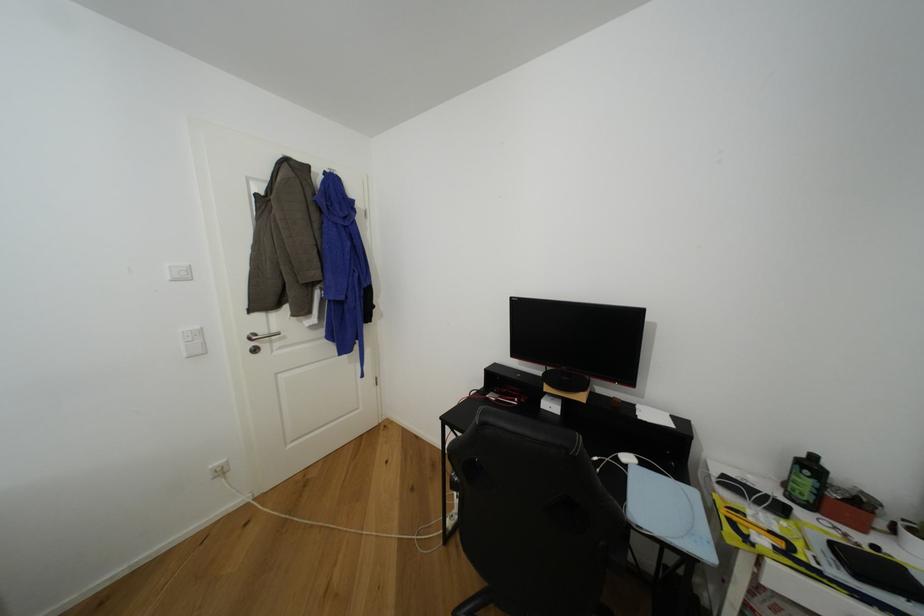
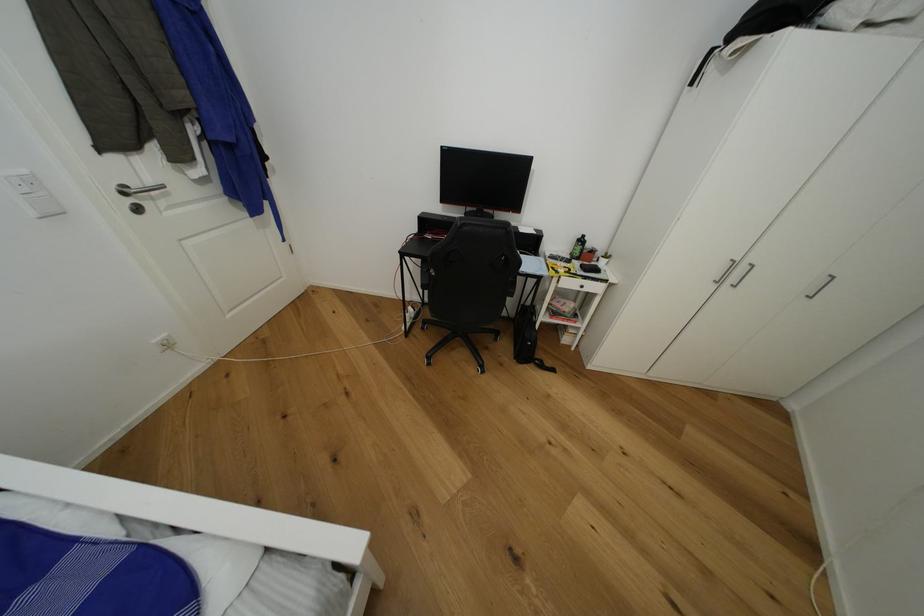
The first image is from the beginning of the video and the second image is from the end. How did the camera likely rotate when shooting the video?

The rotation direction of the camera is right-down.